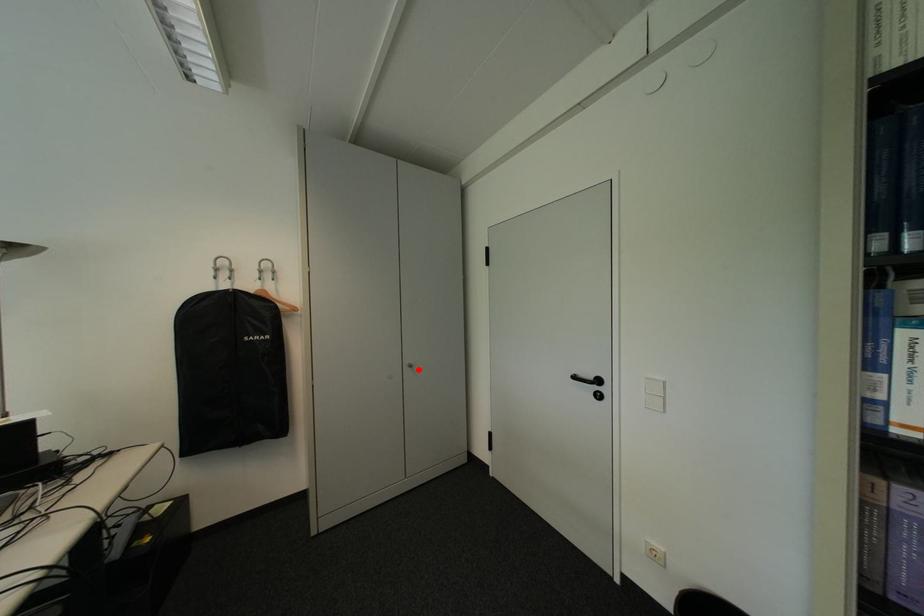
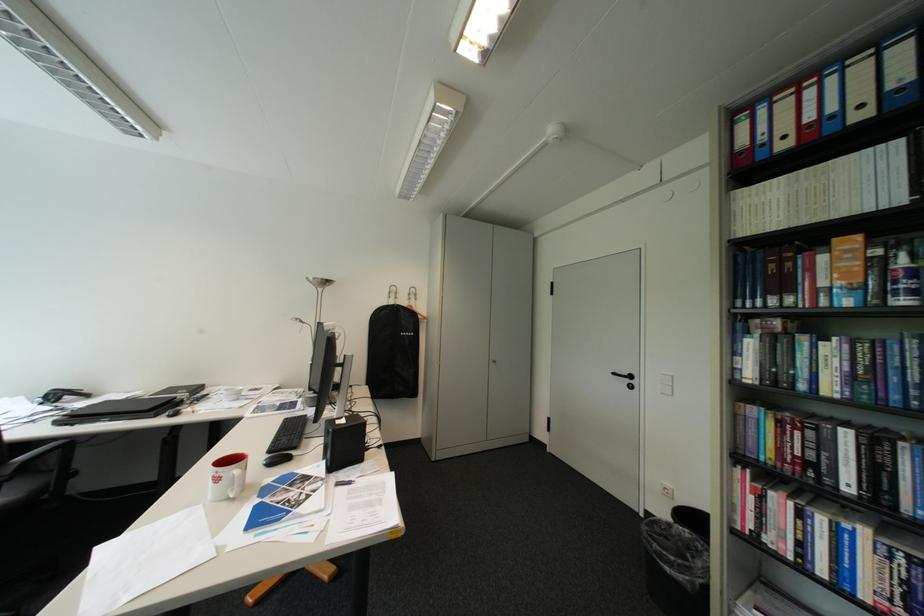
In the second image, find the point that corresponds to the highlighted location in the first image.

(504, 363)